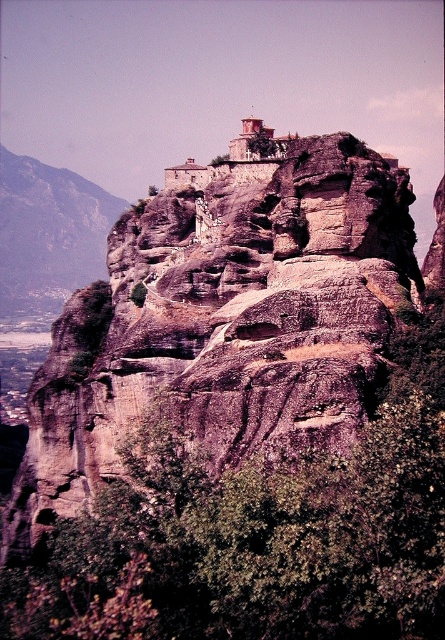
You are a hiker standing at the base of the cliff and want to reach the monastery. Which object, the rustic stone cliff at upper center or the rugged stone mountain at left, is closer to you as you look towards the monastery?

The rustic stone cliff at upper center is closer to you because it is in front of the rugged stone mountain at left, making it the first obstacle on your path to the monastery.

You are a hiker planning to climb the rustic stone cliff at upper center and the rugged stone mountain at left. Based on their widths, which one might be easier to climb? Please explain your reasoning.

The rustic stone cliff at upper center has a larger width than the rugged stone mountain at left. A wider base might provide more stable footing and a less steep incline, making it potentially easier to climb compared to the narrower mountain.